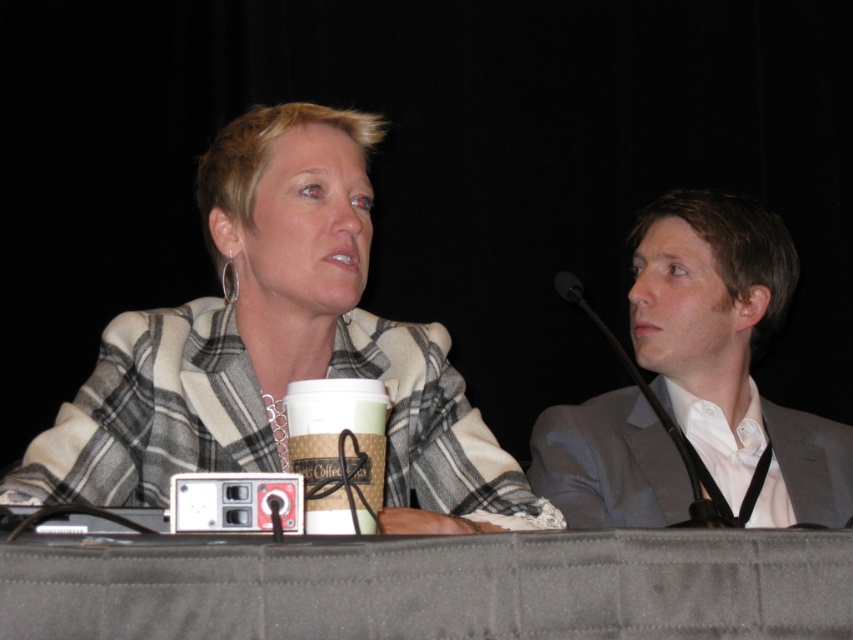
Question: Is plaid fabric jacket at center thinner than brown paper cup at center?

Choices:
 (A) no
 (B) yes

Answer: (A)

Question: Can you confirm if gray fabric suit at right is wider than black matte microphone at right?

Choices:
 (A) yes
 (B) no

Answer: (A)

Question: Which object is closer to the camera taking this photo?

Choices:
 (A) black matte microphone at right
 (B) plaid fabric jacket at center
 (C) gray fabric suit at right
 (D) brown paper cup at center

Answer: (A)

Question: Which point is farther from the camera taking this photo?

Choices:
 (A) (323, 227)
 (B) (599, 324)
 (C) (323, 433)
 (D) (683, 387)

Answer: (D)

Question: Among these objects, which one is nearest to the camera?

Choices:
 (A) plaid fabric jacket at center
 (B) gray fabric suit at right

Answer: (A)

Question: Can you confirm if gray fabric suit at right is bigger than brown paper cup at center?

Choices:
 (A) yes
 (B) no

Answer: (A)